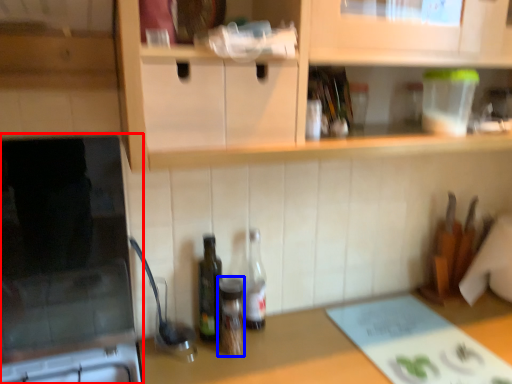
Question: Which object appears closest to the camera in this image, appliance (highlighted by a red box) or bottle (highlighted by a blue box)?

Choices:
 (A) appliance
 (B) bottle

Answer: (A)